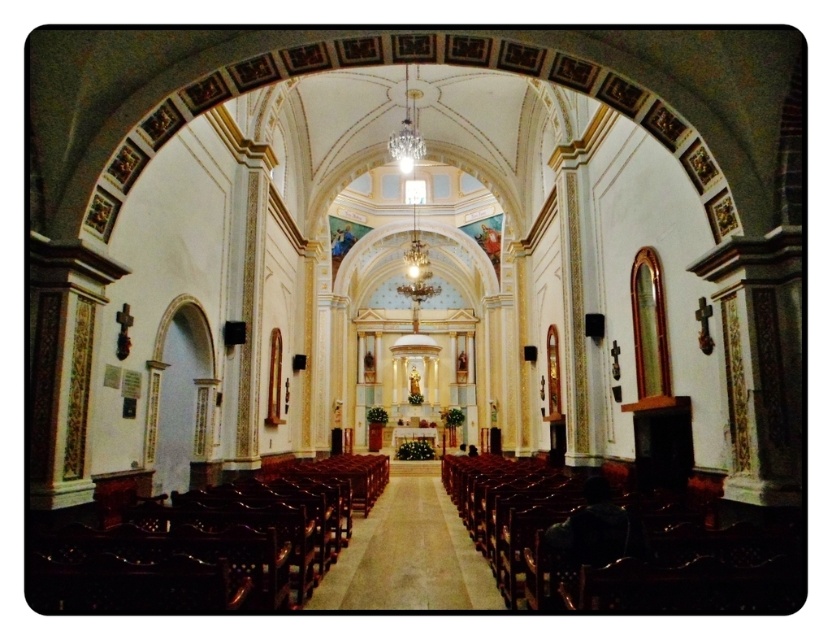
Question: Which of the following is the closest to the observer?

Choices:
 (A) (112, 506)
 (B) (404, 461)
 (C) (626, 500)

Answer: (C)

Question: Is polished dark wood chairs at left positioned in front of wooden polished aisle at center?

Choices:
 (A) no
 (B) yes

Answer: (B)

Question: Can you confirm if polished dark wood chairs at left is positioned to the right of wooden polished aisle at center?

Choices:
 (A) no
 (B) yes

Answer: (A)

Question: Which object is the closest to the polished dark wood chairs at left?

Choices:
 (A) wooden polished aisle at center
 (B) mahogany polished wood chair at lower right

Answer: (A)

Question: Does mahogany polished wood chair at lower right lie in front of wooden polished aisle at center?

Choices:
 (A) yes
 (B) no

Answer: (A)

Question: Which point is farther from the camera taking this photo?

Choices:
 (A) (712, 550)
 (B) (479, 570)

Answer: (B)